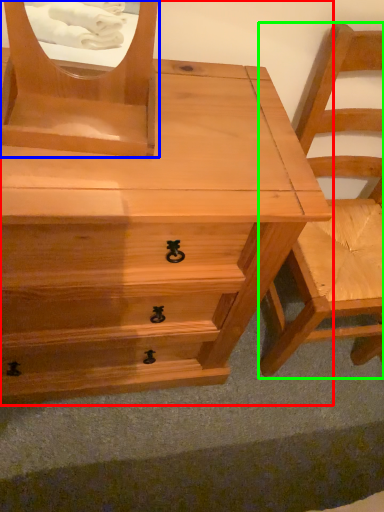
Question: Which object is the closest to the chest of drawers (highlighted by a red box)? Choose among these: mirror (highlighted by a blue box) or chair (highlighted by a green box).

Choices:
 (A) mirror
 (B) chair

Answer: (A)